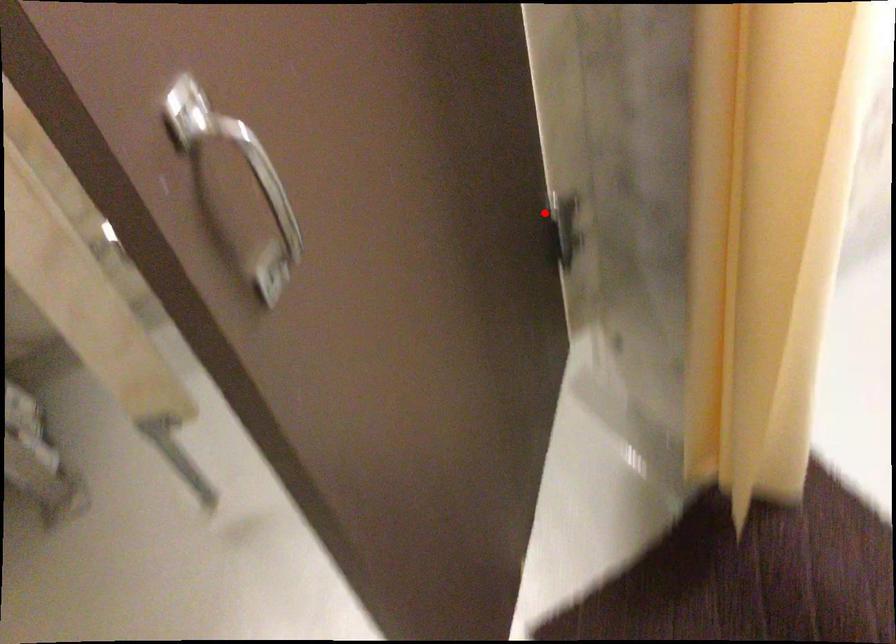
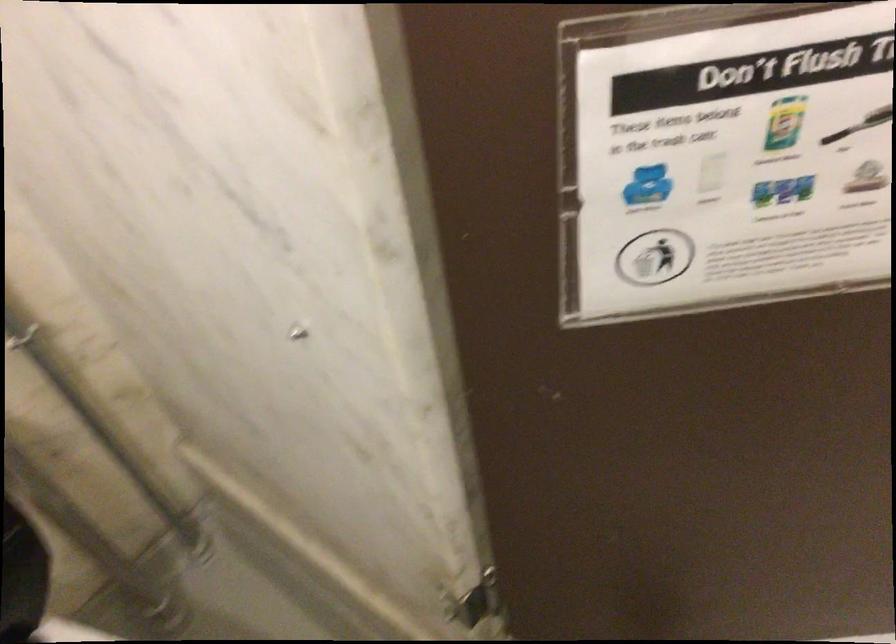
In the second image, find the point that corresponds to the highlighted location in the first image.

(476, 603)